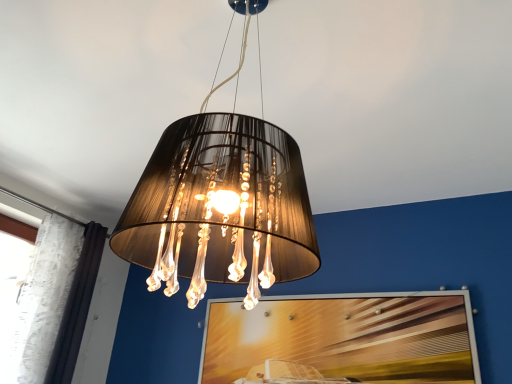
Question: Considering the positions of white lace curtain at left and matte black lampshade at center in the image, is white lace curtain at left bigger or smaller than matte black lampshade at center?

Choices:
 (A) small
 (B) big

Answer: (A)

Question: Is white lace curtain at left in front of or behind matte black lampshade at center in the image?

Choices:
 (A) front
 (B) behind

Answer: (B)

Question: Which of these objects is positioned closest to the wooden textured picture frame at center?

Choices:
 (A) white lace curtain at left
 (B) matte black lampshade at center

Answer: (A)

Question: Based on their relative distances, which object is farther from the white lace curtain at left?

Choices:
 (A) wooden textured picture frame at center
 (B) matte black lampshade at center

Answer: (B)